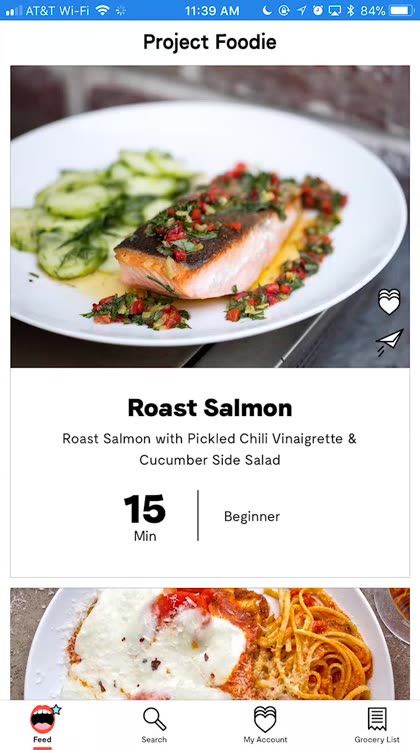
Image resolution: width=420 pixels, height=750 pixels. What are the coordinates of `white plate` in the screenshot? It's located at (210, 166).